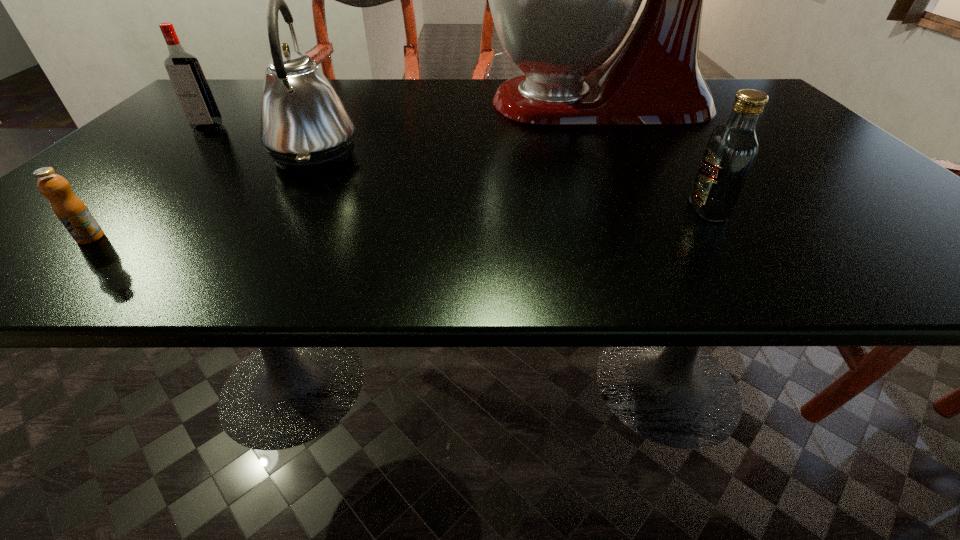
In order to click on vacant space located 0.390m at the attachment hub of the mixer in this screenshot , I will do `click(327, 103)`.

At what (x,y) coordinates should I click in order to perform the action: click on free space located 0.080m on the left of the kettle. Please return your answer as a coordinate pair (x, y). This screenshot has width=960, height=540. Looking at the image, I should click on (233, 155).

Locate an element on the screen. This screenshot has width=960, height=540. vacant space situated on the front and back of the left vodka is located at coordinates pos(85,239).

Find the location of `free space located 0.400m on the front-facing side of the right vodka`. free space located 0.400m on the front-facing side of the right vodka is located at coordinates (459, 208).

Where is `vacant space located 0.100m on the front-facing side of the right vodka`? This screenshot has width=960, height=540. vacant space located 0.100m on the front-facing side of the right vodka is located at coordinates (634, 208).

Locate an element on the screen. The height and width of the screenshot is (540, 960). free region located on the front-facing side of the right vodka is located at coordinates (622, 208).

Find the location of a particular element. The height and width of the screenshot is (540, 960). vacant space located on the front label of the nearest object is located at coordinates (50, 275).

The width and height of the screenshot is (960, 540). I want to click on object that is at the far edge, so click(562, 0).

The width and height of the screenshot is (960, 540). Identify the location of object at the near edge. (72, 212).

Find the location of `vodka that is positioned at the left edge`. vodka that is positioned at the left edge is located at coordinates (188, 80).